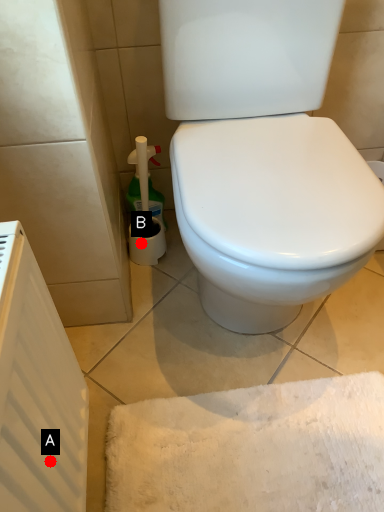
Question: Two points are circled on the image, labeled by A and B beside each circle. Which point is farther to the camera?

Choices:
 (A) A is further
 (B) B is further

Answer: (B)